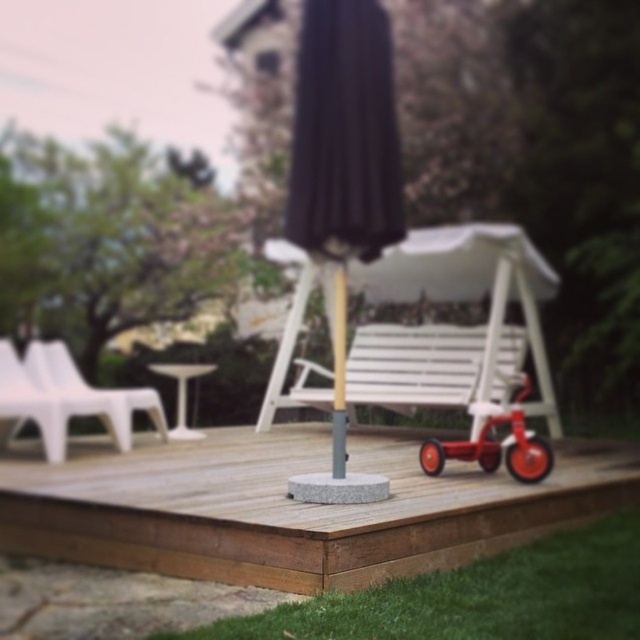
Question: Does white wood chair at center appear under white plastic stool at lower center?

Choices:
 (A) no
 (B) yes

Answer: (A)

Question: Is black fabric umbrella at center positioned behind white plastic chair at left?

Choices:
 (A) no
 (B) yes

Answer: (A)

Question: Observing the image, what is the correct spatial positioning of wooden deck at center in reference to wooden pole at center?

Choices:
 (A) left
 (B) right

Answer: (A)

Question: Which of these objects is positioned closest to the white wood chair at center?

Choices:
 (A) white plastic stool at lower center
 (B) white plastic chair at left
 (C) wooden pole at center

Answer: (A)

Question: Among these points, which one is nearest to the camera?

Choices:
 (A) (179, 378)
 (B) (632, 454)
 (C) (156, 417)
 (D) (344, 310)

Answer: (D)

Question: Which of the following is the farthest from the observer?

Choices:
 (A) (358, 145)
 (B) (131, 403)

Answer: (B)